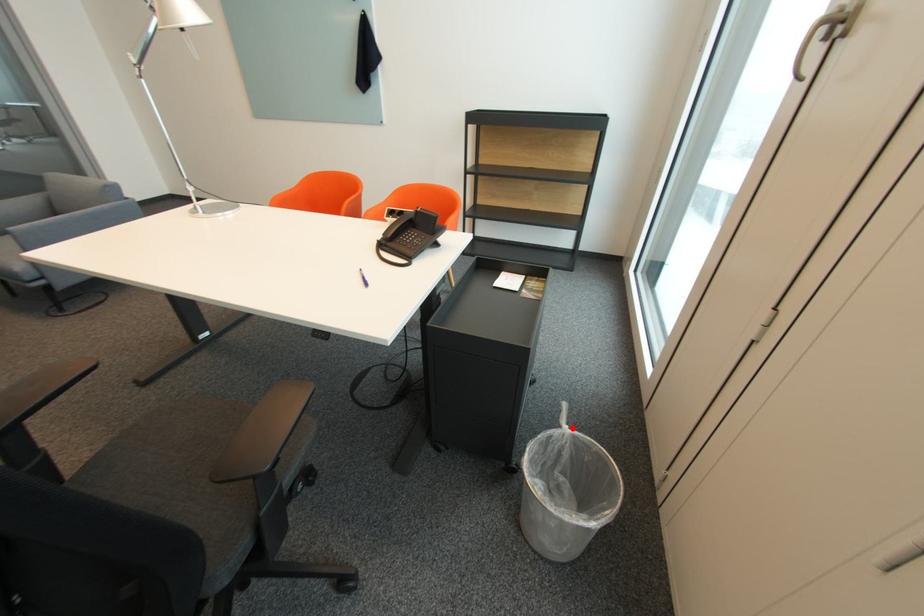
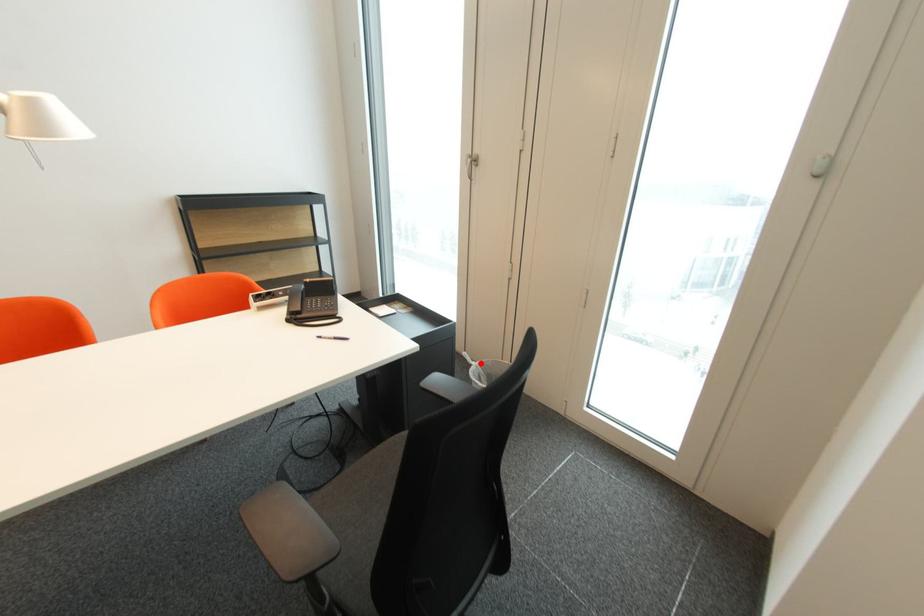
I am providing you with two images of the same scene from different viewpoints. A red point is marked on the first image and another point is marked on the second image. Is the marked point in image1 the same physical position as the marked point in image2?

Yes